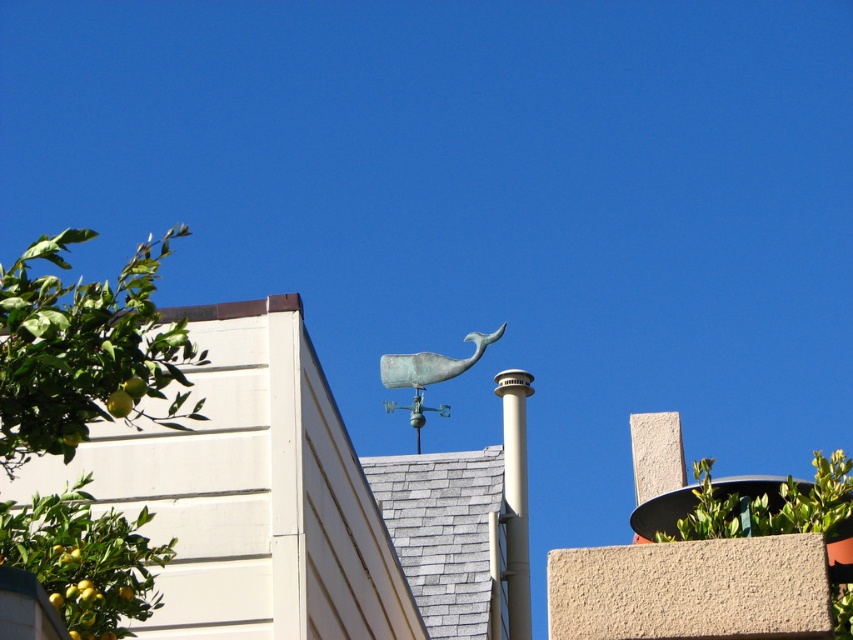
You are standing in the middle of a field looking at the green leafy tree at left and the green leafy tree at upper center. Which tree is closer to you?

The green leafy tree at left is closer to you since it is only 18.01 meters away from the green leafy tree at upper center.

You are standing in front of the white building and want to determine which tree is narrower between the green leafy tree at left and the green leafy tree at upper center. Which one is narrower?

The green leafy tree at left is narrower than the green leafy tree at upper center.

You are standing in front of a building and want to take a photo of the green leafy tree at left without including the weather vane on the roof. Based on the distance, can you step back enough to exclude the weather vane in your shot?

The green leafy tree at left is 19.19 meters away from camera. Since the weather vane is closer to the camera than the tree, stepping back might bring both into the same frame. To exclude the weather vane, you need to move sideways or adjust your angle instead of stepping back.